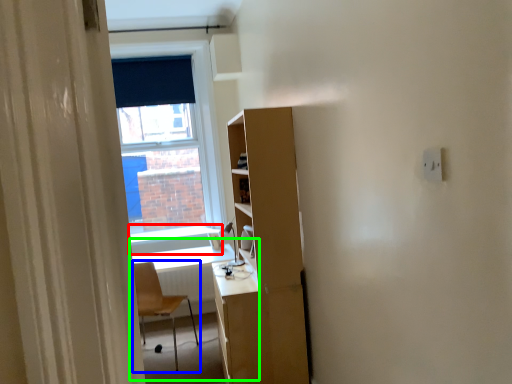
Question: Considering the real-world distances, which object is farthest from window sill (highlighted by a red box)? chair (highlighted by a blue box) or computer desk (highlighted by a green box)?

Choices:
 (A) chair
 (B) computer desk

Answer: (A)